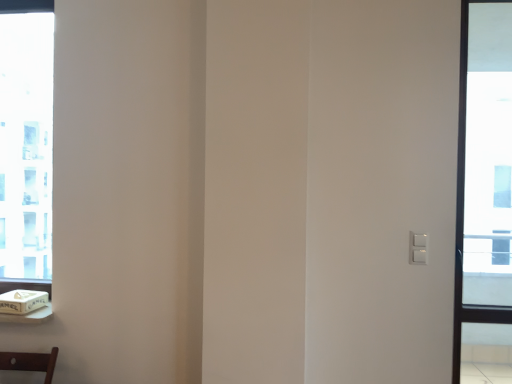
Question: Is transparent glass window at right, which appears as the second window when viewed from the back, bigger than clear glass window at left, positioned as the first window in back-to-front order?

Choices:
 (A) no
 (B) yes

Answer: (B)

Question: Does transparent glass window at right, which appears as the second window when viewed from the back, appear on the right side of clear glass window at left, arranged as the second window when viewed from the front?

Choices:
 (A) yes
 (B) no

Answer: (A)

Question: Does transparent glass window at right, arranged as the 1th window when viewed from the right, have a lesser width compared to clear glass window at left, the 2th window in the right-to-left sequence?

Choices:
 (A) no
 (B) yes

Answer: (A)

Question: Could you tell me if transparent glass window at right, which appears as the second window when viewed from the back, is turned towards clear glass window at left, positioned as the first window in back-to-front order?

Choices:
 (A) yes
 (B) no

Answer: (B)

Question: Is transparent glass window at right, arranged as the 1th window when viewed from the right, positioned far away from clear glass window at left, arranged as the second window when viewed from the front?

Choices:
 (A) yes
 (B) no

Answer: (A)

Question: Is transparent glass window at right, which appears as the second window when viewed from the back, to the left of clear glass window at left, positioned as the first window in back-to-front order, from the viewer's perspective?

Choices:
 (A) no
 (B) yes

Answer: (A)

Question: Considering the relative sizes of transparent glass window at right, arranged as the 1th window when viewed from the right, and white cardboard box at lower left in the image provided, is transparent glass window at right, arranged as the 1th window when viewed from the right, shorter than white cardboard box at lower left?

Choices:
 (A) yes
 (B) no

Answer: (B)

Question: Is transparent glass window at right, the first window from the front, thinner than white cardboard box at lower left?

Choices:
 (A) no
 (B) yes

Answer: (B)

Question: Is transparent glass window at right, arranged as the 1th window when viewed from the right, taller than white cardboard box at lower left?

Choices:
 (A) no
 (B) yes

Answer: (B)

Question: From a real-world perspective, is transparent glass window at right, arranged as the 1th window when viewed from the right, positioned over white cardboard box at lower left based on gravity?

Choices:
 (A) yes
 (B) no

Answer: (A)

Question: Is transparent glass window at right, which appears as the second window when viewed from the back, next to white cardboard box at lower left?

Choices:
 (A) no
 (B) yes

Answer: (A)

Question: From a real-world perspective, is transparent glass window at right, the 2th window viewed from the left, physically below white cardboard box at lower left?

Choices:
 (A) no
 (B) yes

Answer: (A)

Question: From the image's perspective, is clear glass window at left, arranged as the second window when viewed from the front, above white cardboard box at lower left?

Choices:
 (A) no
 (B) yes

Answer: (B)